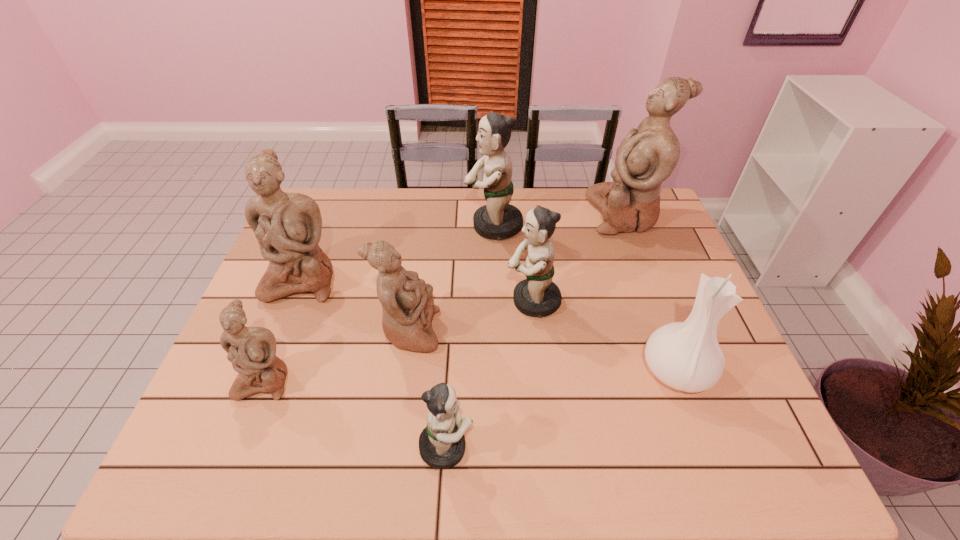
You are a GUI agent. You are given a task and a screenshot of the screen. Output one action in this format:
    pyautogui.click(x=<x>, y=<y>)
    Task: Click on the vacant point that satisfies the following two spatial constraints: 1. on the front-facing side of the rightmost white figurine; 2. on the front-facing side of the second nearest figurine
    The width and height of the screenshot is (960, 540).
    Given the screenshot: What is the action you would take?
    pyautogui.click(x=687, y=380)